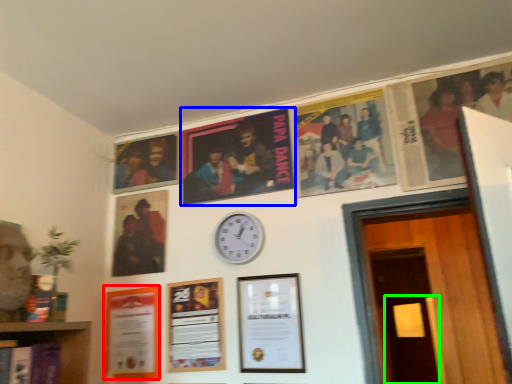
Question: Considering the real-world distances, which object is closest to picture frame (highlighted by a red box)? poster (highlighted by a blue box) or door (highlighted by a green box).

Choices:
 (A) poster
 (B) door

Answer: (A)